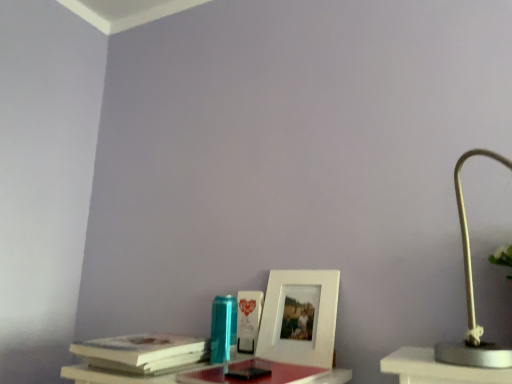
Find the location of a particular element. This screenshot has height=384, width=512. vacant space situated above smooth plastic table at lower center (from a real-world perspective) is located at coordinates (254, 373).